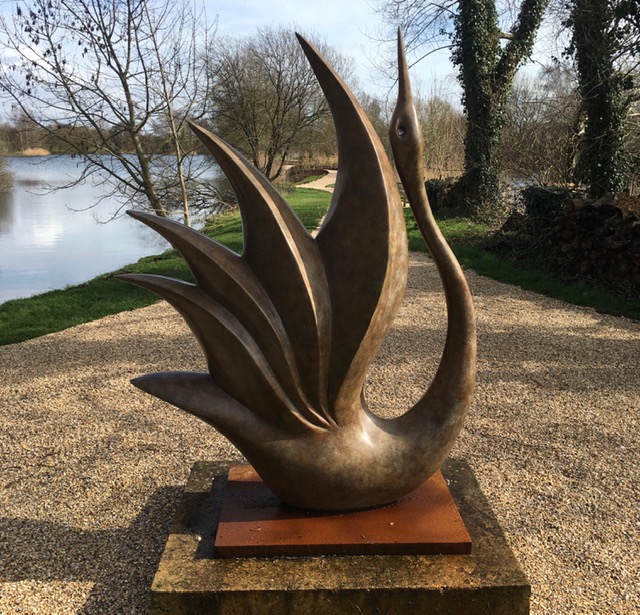
This screenshot has height=615, width=640. In order to click on sculpture's square metal plate in this screenshot , I will do `click(418, 534)`.